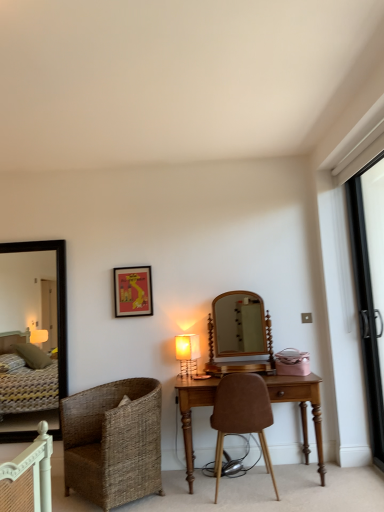
Identify the location of vacant space that's between brown leather chair at center, arranged as the second chair when viewed from the left, and wooden desk at center. (287, 489).